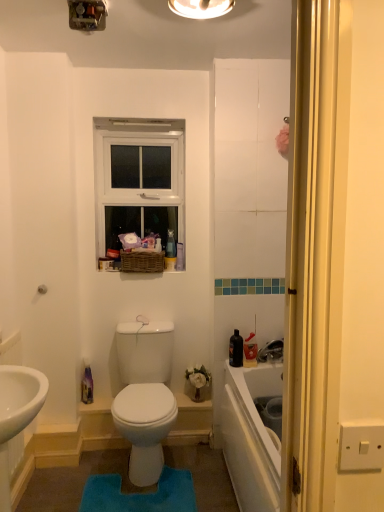
At what (x,y) coordinates should I click in order to perform the action: click on vacant area on top of blue plush bath mat at center (from a real-world perspective). Please return your answer as a coordinate pair (x, y). Image resolution: width=384 pixels, height=512 pixels. Looking at the image, I should click on (128, 490).